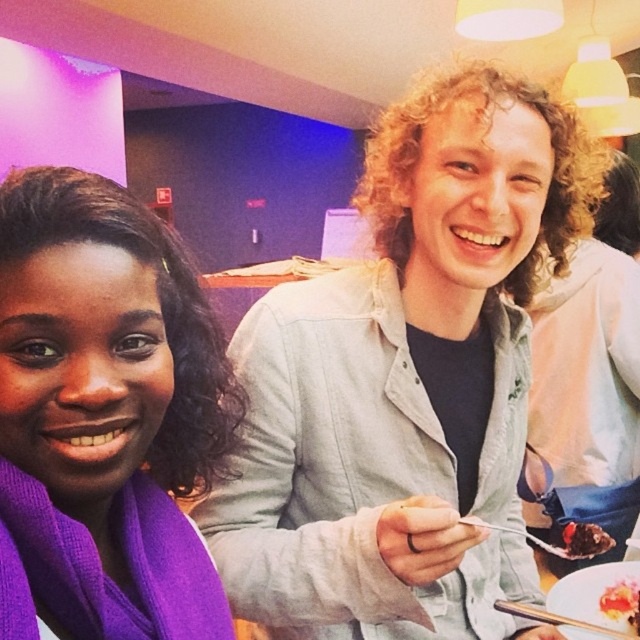
Question: Which point is farther from the camera taking this photo?

Choices:
 (A) (632, 588)
 (B) (612, 573)
 (C) (566, 538)
 (D) (209, 362)

Answer: (C)

Question: Which of the following is the farthest from the observer?

Choices:
 (A) smooth chocolate cake at center
 (B) purple wool scarf at upper left
 (C) purple scarf at left
 (D) white glossy plate at lower right

Answer: (A)

Question: Can you confirm if purple wool scarf at upper left is bigger than white glossy plate at lower right?

Choices:
 (A) yes
 (B) no

Answer: (A)

Question: Which is farther from the chocolate cake at lower right?

Choices:
 (A) purple scarf at left
 (B) purple wool scarf at upper left

Answer: (A)

Question: Where is purple wool scarf at upper left located in relation to purple scarf at left in the image?

Choices:
 (A) below
 (B) above

Answer: (A)

Question: Does purple scarf at left appear over smooth chocolate cake at center?

Choices:
 (A) no
 (B) yes

Answer: (B)